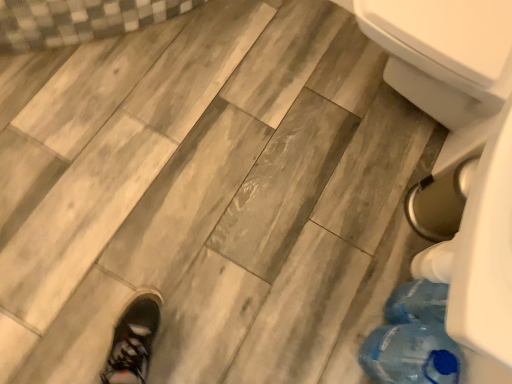
At what (x,y) coordinates should I click in order to perform the action: click on vacant space to the left of white plastic bidet at lower right. Please return your answer as a coordinate pair (x, y). Image resolution: width=512 pixels, height=384 pixels. Looking at the image, I should click on (260, 76).